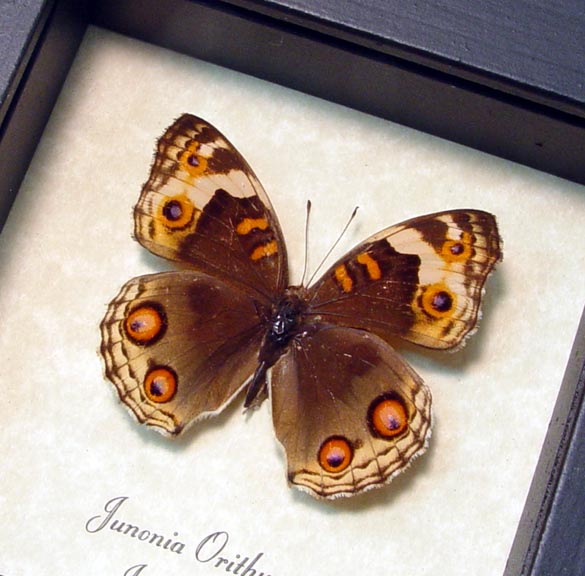
I want to click on frame, so click(512, 137).